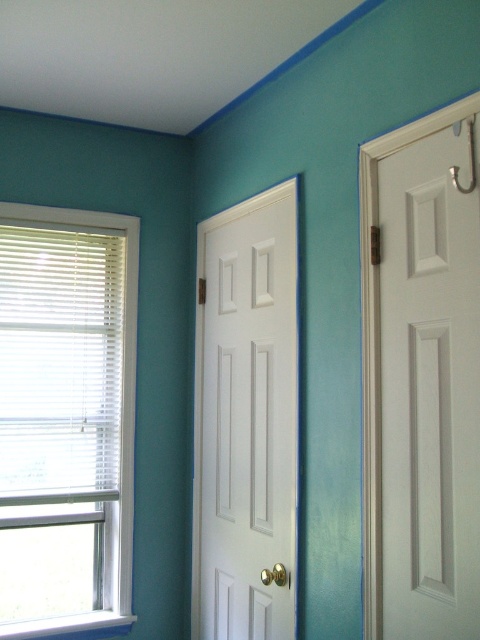
Question: Can you confirm if white matte door at right is positioned to the left of white glossy door at center?

Choices:
 (A) no
 (B) yes

Answer: (A)

Question: Among these points, which one is nearest to the camera?

Choices:
 (A) (251, 582)
 (B) (412, 552)
 (C) (87, 449)

Answer: (B)

Question: Which point is closer to the camera?

Choices:
 (A) (452, 612)
 (B) (218, 460)

Answer: (A)

Question: Can you confirm if white plastic window at left is positioned below white matte door at right?

Choices:
 (A) no
 (B) yes

Answer: (B)

Question: Observing the image, what is the correct spatial positioning of white plastic window at left in reference to white glossy door at center?

Choices:
 (A) left
 (B) right

Answer: (A)

Question: Among these points, which one is farthest from the camera?

Choices:
 (A) (129, 499)
 (B) (243, 400)

Answer: (A)